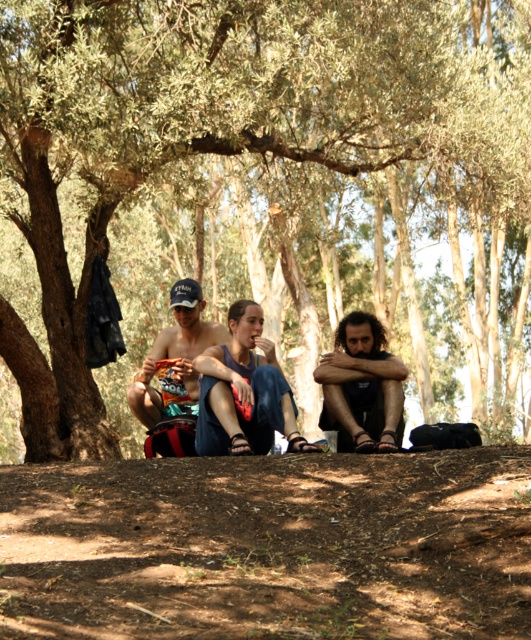
You are standing at the point labeled as point (371, 358) and want to walk towards the point labeled as point (453, 406). Which direction should you move in relation to the olive tree?

Since point (453, 406) is behind point (371, 358), you should move away from the olive tree to reach it.

You are a photographer trying to capture a clear photo of the blue denim jeans at center and the matte black cap at center. Which object should you focus on first if you want to ensure both are in focus?

The blue denim jeans at center is in front of the matte black cap at center. To ensure both are in focus, you should focus on the matte black cap at center first since it is further back, allowing the depth of field to cover both objects.